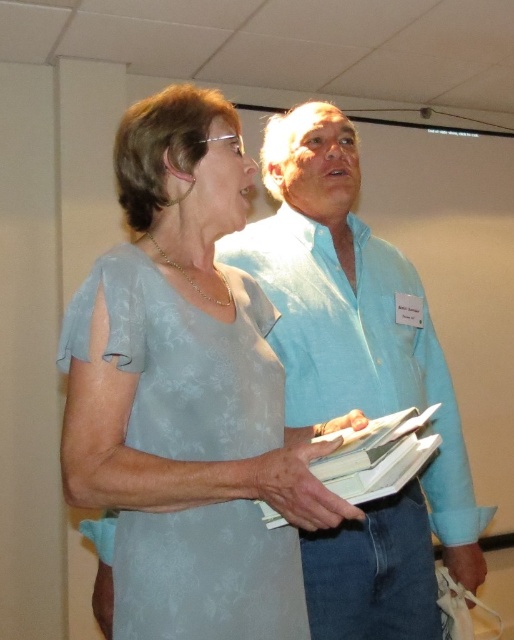
Which is behind, point (311, 532) or point (277, 404)?

The point (311, 532) is more distant.

How distant is light blue shirt at center from matte blue dress at center?

The distance of light blue shirt at center from matte blue dress at center is 31.73 centimeters.

You are a GUI agent. You are given a task and a screenshot of the screen. Output one action in this format:
    pyautogui.click(x=<x>, y=<y>)
    Task: Click on the light blue shirt at center
    
    Given the screenshot: What is the action you would take?
    pyautogui.click(x=357, y=380)